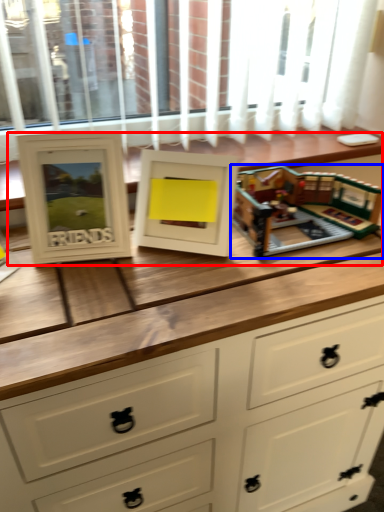
Question: Which object is further to the camera taking this photo, buffet (highlighted by a red box) or toy (highlighted by a blue box)?

Choices:
 (A) buffet
 (B) toy

Answer: (A)